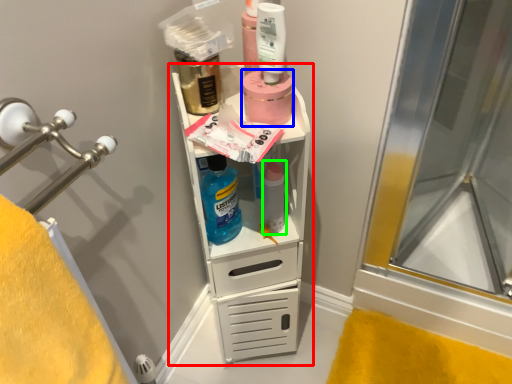
Question: Estimate the real-world distances between objects in this image. Which object is closer to bathroom cabinet (highlighted by a red box), product (highlighted by a blue box) or toiletry (highlighted by a green box)?

Choices:
 (A) product
 (B) toiletry

Answer: (B)